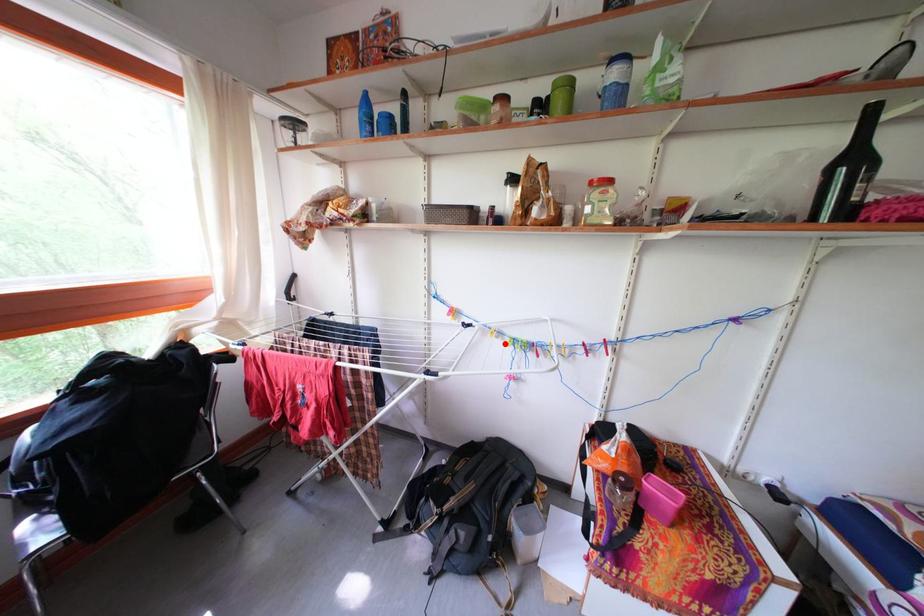
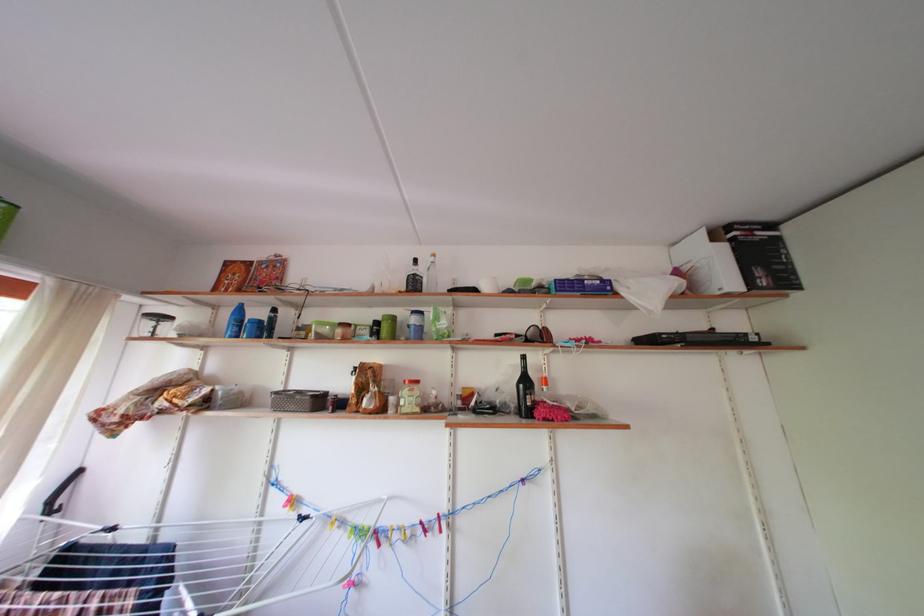
Where in the second image is the point corresponding to the highlighted location from the first image?

(346, 535)